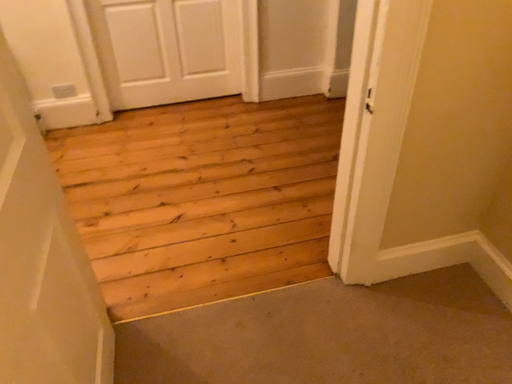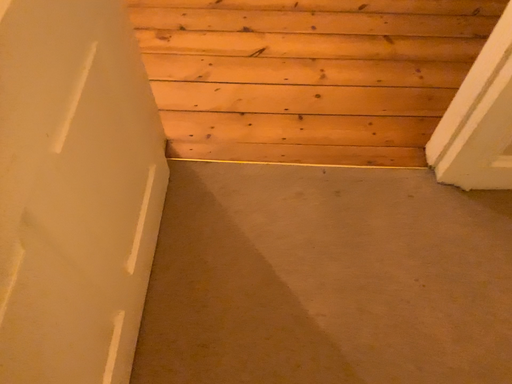
Question: How did the camera likely rotate when shooting the video?

Choices:
 (A) rotated left
 (B) rotated right

Answer: (A)